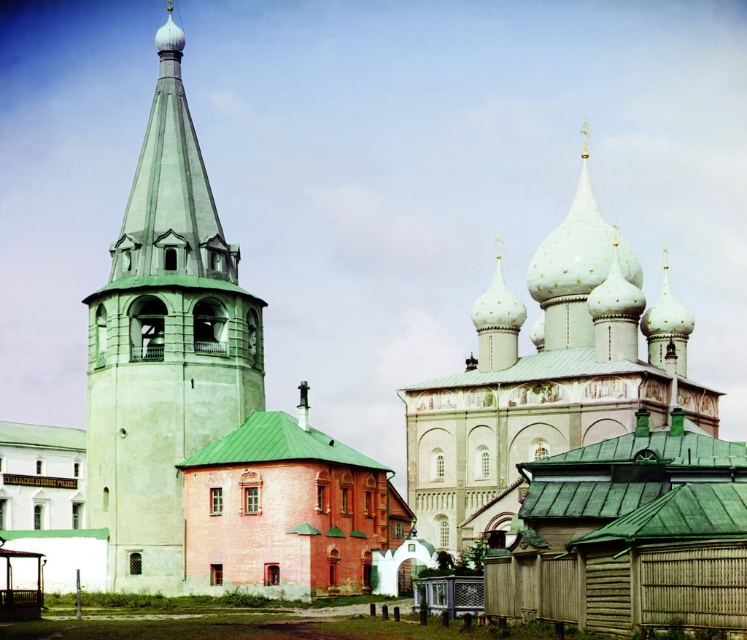
Question: Can you confirm if green tiled bell tower at left is positioned below white painted stone tower at upper center?

Choices:
 (A) yes
 (B) no

Answer: (B)

Question: From the image, what is the correct spatial relationship of green tiled bell tower at left in relation to white painted stone tower at upper center?

Choices:
 (A) above
 (B) below

Answer: (A)

Question: Is green tiled bell tower at left below white painted stone tower at upper center?

Choices:
 (A) no
 (B) yes

Answer: (A)

Question: Among these objects, which one is nearest to the camera?

Choices:
 (A) green tiled bell tower at left
 (B) white painted stone tower at upper center

Answer: (A)

Question: Which object is farther from the camera taking this photo?

Choices:
 (A) white painted stone tower at upper center
 (B) green tiled bell tower at left

Answer: (A)